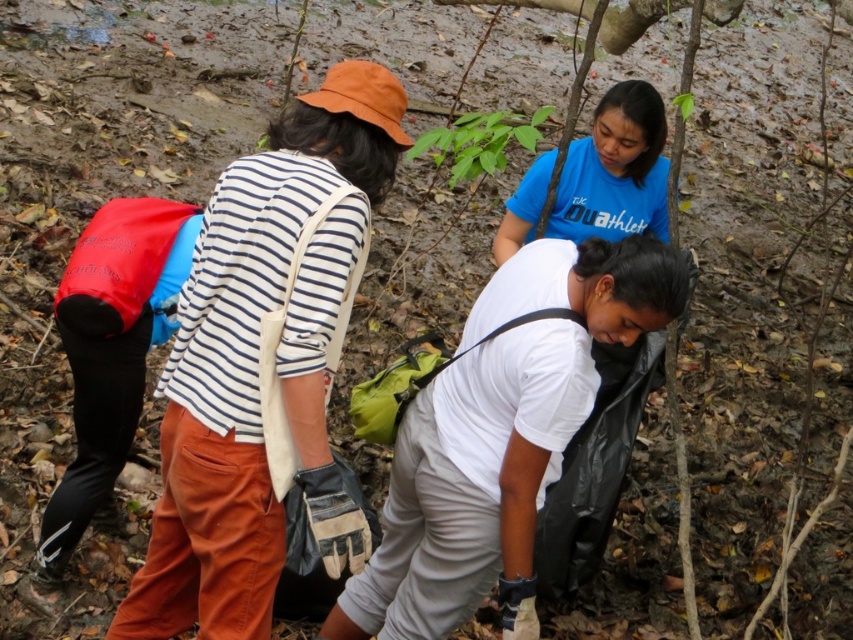
Between matte striped shirt at center and blue matte shirt at center, which one is positioned lower?

matte striped shirt at center

Which is more to the right, matte striped shirt at center or blue matte shirt at center?

blue matte shirt at center

Does point (346, 172) come farther from viewer compared to point (657, 92)?

No, (346, 172) is closer to viewer.

I want to click on matte striped shirt at center, so click(x=257, y=355).

Can you confirm if white matte shirt at center is wider than blue matte shirt at center?

Correct, the width of white matte shirt at center exceeds that of blue matte shirt at center.

Does point (518, 486) come in front of point (549, 212)?

Yes.

This screenshot has height=640, width=853. I want to click on white matte shirt at center, so click(x=500, y=436).

Who is lower down, matte striped shirt at center or white matte shirt at center?

Positioned lower is white matte shirt at center.

The image size is (853, 640). Identify the location of matte striped shirt at center. (257, 355).

Identify the location of matte striped shirt at center. (257, 355).